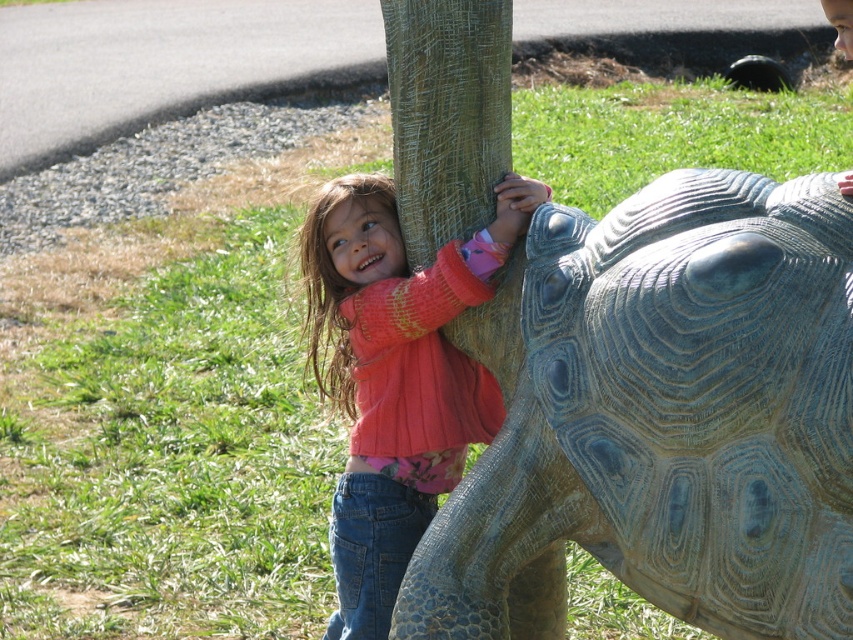
Is green textured tortoise at center smaller than pink sweater at center?

Actually, green textured tortoise at center might be larger than pink sweater at center.

Image resolution: width=853 pixels, height=640 pixels. Describe the element at coordinates (666, 420) in the screenshot. I see `green textured tortoise at center` at that location.

Where is `green textured tortoise at center`? Image resolution: width=853 pixels, height=640 pixels. green textured tortoise at center is located at coordinates (666, 420).